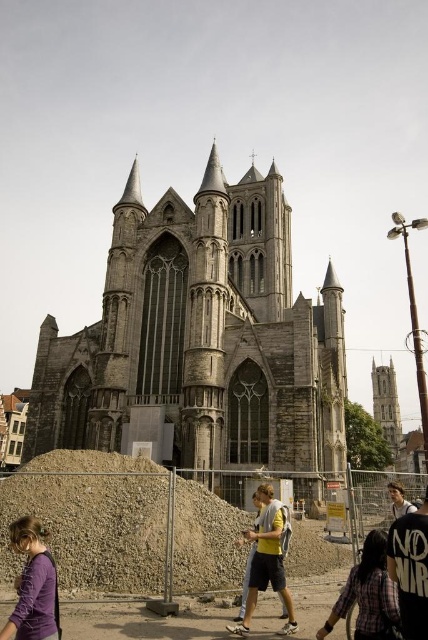
Question: Is gravel pile at center in front of smooth stone tower at upper right?

Choices:
 (A) yes
 (B) no

Answer: (A)

Question: Which of these objects is positioned closest to the plaid shirt at lower right?

Choices:
 (A) yellow fabric backpack at center
 (B) gravelly dirt mound at lower center
 (C) purple soft fabric at lower left

Answer: (A)

Question: Is gravel pile at center smaller than smooth stone tower at upper right?

Choices:
 (A) no
 (B) yes

Answer: (B)

Question: Among these points, which one is nearest to the camera?

Choices:
 (A) (394, 541)
 (B) (395, 497)

Answer: (A)

Question: Which of the following is the farthest from the observer?

Choices:
 (A) (416, 538)
 (B) (261, 556)
 (C) (380, 380)

Answer: (C)

Question: Observing the image, what is the correct spatial positioning of gravelly dirt mound at lower center in reference to dark gray hoodie at lower right?

Choices:
 (A) below
 (B) above

Answer: (B)